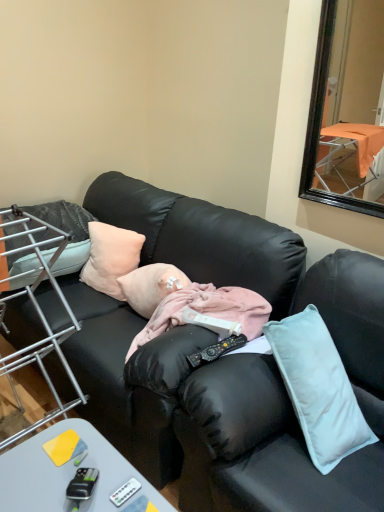
Question: From their relative heights in the image, would you say black plastic remote control at center, marked as the 2th remote control in a left-to-right arrangement, is taller or shorter than white plastic remote control at lower center, the 1th remote control when ordered from bottom to top?

Choices:
 (A) tall
 (B) short

Answer: (A)

Question: In the image, is black plastic remote control at center, which is the first remote control from right to left, positioned in front of or behind white plastic remote control at lower center, the second remote control positioned from the top?

Choices:
 (A) behind
 (B) front

Answer: (A)

Question: Which of these objects is positioned farthest from the pink fabric at center, arranged as the first person when viewed from the front?

Choices:
 (A) gray plastic desk at lower left
 (B) black leather couch at center
 (C) pink fabric at center, the first person when ordered from back to front
 (D) metal wire rack at left
 (E) black plastic remote control at center, the 1th remote control positioned from the back

Answer: (A)

Question: Based on their relative distances, which object is farther from the white plastic remote control at lower center, arranged as the 1th remote control when viewed from the front?

Choices:
 (A) soft pink pillow at left, arranged as the first pillow when viewed from the left
 (B) gray plastic desk at lower left
 (C) black plastic remote control at center, which appears as the second remote control when ordered from the bottom
 (D) black leather couch at center
 (E) pink fabric at center, the first person when ordered from back to front

Answer: (A)